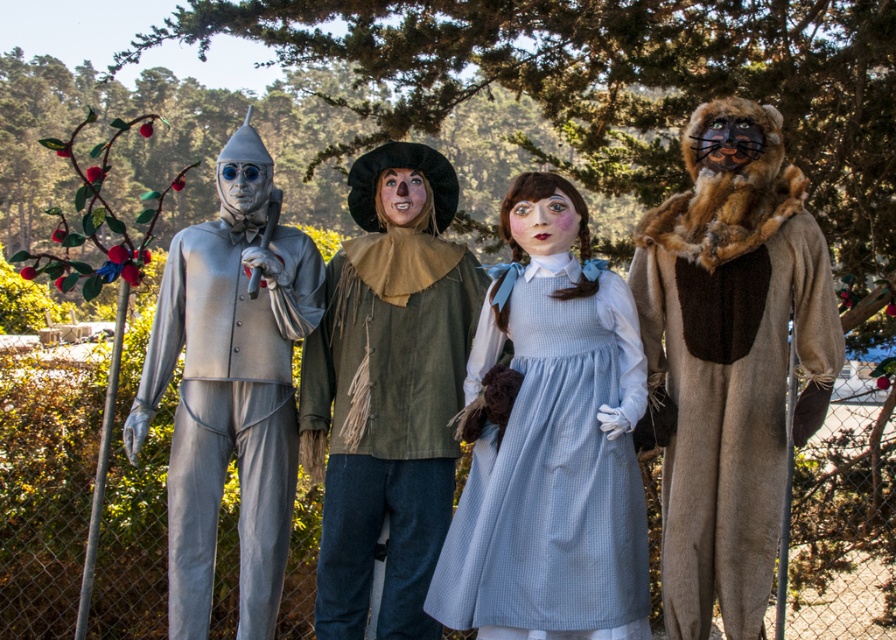
Question: Which object is the closest to the green fabric costume at center?

Choices:
 (A) metallic silver suit at left
 (B) light blue gingham dress at center

Answer: (A)

Question: Which point is closer to the camera?

Choices:
 (A) (695, 579)
 (B) (347, 518)
 (C) (226, 344)
 (D) (616, 280)

Answer: (A)

Question: Which point is farther to the camera?

Choices:
 (A) click(507, 465)
 (B) click(304, 332)
 (C) click(648, 230)
 (D) click(427, 163)

Answer: (D)

Question: Does fuzzy brown costume at right appear on the left side of light blue gingham dress at center?

Choices:
 (A) no
 (B) yes

Answer: (A)

Question: Is green fabric costume at center smaller than light blue gingham dress at center?

Choices:
 (A) no
 (B) yes

Answer: (A)

Question: Can you confirm if green fabric costume at center is positioned to the left of metallic silver suit at left?

Choices:
 (A) yes
 (B) no

Answer: (B)